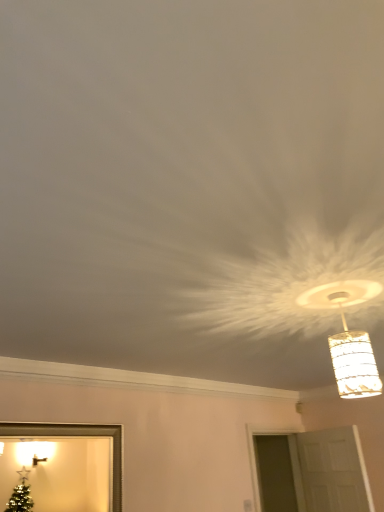
Question: Can we say translucent glass pendant light at upper right lies outside white matte door at lower right?

Choices:
 (A) yes
 (B) no

Answer: (A)

Question: From the image's perspective, is translucent glass pendant light at upper right above white matte door at lower right?

Choices:
 (A) no
 (B) yes

Answer: (B)

Question: Considering the relative positions of translucent glass pendant light at upper right and white matte door at lower right in the image provided, is translucent glass pendant light at upper right to the left of white matte door at lower right from the viewer's perspective?

Choices:
 (A) yes
 (B) no

Answer: (A)

Question: Is the position of translucent glass pendant light at upper right more distant than that of white matte door at lower right?

Choices:
 (A) no
 (B) yes

Answer: (A)

Question: Does translucent glass pendant light at upper right appear on the right side of white matte door at lower right?

Choices:
 (A) no
 (B) yes

Answer: (A)

Question: Looking at the image, does white matte door at lower right seem bigger or smaller compared to gold metallic picture frame at lower left?

Choices:
 (A) small
 (B) big

Answer: (B)

Question: Is white matte door at lower right to the left or to the right of gold metallic picture frame at lower left in the image?

Choices:
 (A) left
 (B) right

Answer: (B)

Question: Looking at their shapes, would you say white matte door at lower right is wider or thinner than gold metallic picture frame at lower left?

Choices:
 (A) thin
 (B) wide

Answer: (B)

Question: Considering the positions of white matte door at lower right and gold metallic picture frame at lower left in the image, is white matte door at lower right taller or shorter than gold metallic picture frame at lower left?

Choices:
 (A) tall
 (B) short

Answer: (A)

Question: In terms of height, does translucent glass pendant light at upper right look taller or shorter compared to gold metallic picture frame at lower left?

Choices:
 (A) tall
 (B) short

Answer: (B)

Question: Is translucent glass pendant light at upper right to the left or to the right of gold metallic picture frame at lower left in the image?

Choices:
 (A) left
 (B) right

Answer: (B)

Question: Is translucent glass pendant light at upper right inside or outside of gold metallic picture frame at lower left?

Choices:
 (A) outside
 (B) inside

Answer: (A)

Question: Considering their positions, is translucent glass pendant light at upper right located in front of or behind gold metallic picture frame at lower left?

Choices:
 (A) behind
 (B) front

Answer: (B)

Question: In terms of height, does translucent glass pendant light at upper right look taller or shorter compared to white matte door at lower right?

Choices:
 (A) tall
 (B) short

Answer: (B)

Question: Considering the positions of point (352, 385) and point (331, 481), is point (352, 385) closer or farther from the camera than point (331, 481)?

Choices:
 (A) farther
 (B) closer

Answer: (B)